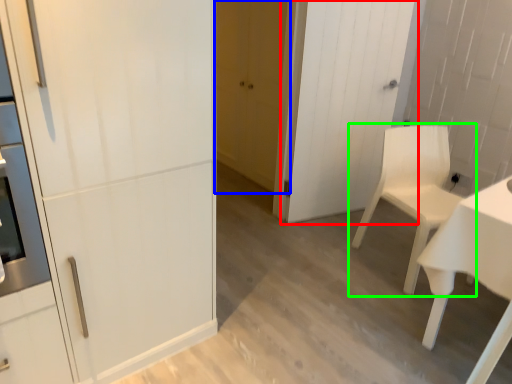
Question: Estimate the real-world distances between objects in this image. Which object is farther from door (highlighted by a red box), door (highlighted by a blue box) or chair (highlighted by a green box)?

Choices:
 (A) door
 (B) chair

Answer: (A)